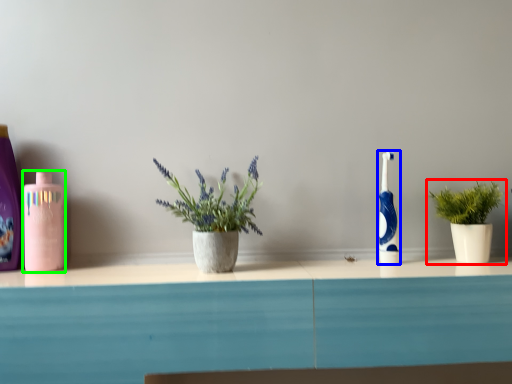
Question: Considering the real-world distances, which object is closest to houseplant (highlighted by a red box)? toothbrush (highlighted by a blue box) or mouthwash (highlighted by a green box).

Choices:
 (A) toothbrush
 (B) mouthwash

Answer: (A)